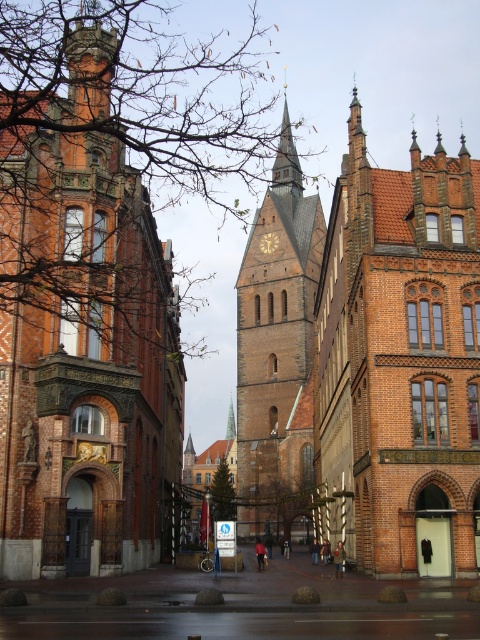
Question: Can you confirm if brown brick tower at center is positioned above green copper spire at center?

Choices:
 (A) no
 (B) yes

Answer: (B)

Question: Which object appears farthest from the camera in this image?

Choices:
 (A) red brick church at left
 (B) brown brick tower at center
 (C) brown brick church at center
 (D) gold textured clock at center

Answer: (D)

Question: Can you confirm if brown brick church at center is positioned to the left of gold textured clock at center?

Choices:
 (A) no
 (B) yes

Answer: (A)

Question: Which point is closer to the camera?

Choices:
 (A) red brick church at left
 (B) green copper spire at center

Answer: (A)

Question: Estimate the real-world distances between objects in this image. Which object is closer to the green copper spire at center?

Choices:
 (A) brown brick tower at center
 (B) red brick church at left
 (C) brown brick church at center

Answer: (A)

Question: Does red brick church at left have a smaller size compared to brown brick tower at center?

Choices:
 (A) no
 (B) yes

Answer: (A)